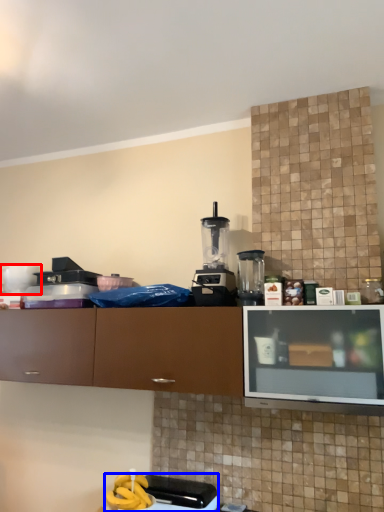
Question: Which object is closer to the camera taking this photo, appliance (highlighted by a red box) or appliance (highlighted by a blue box)?

Choices:
 (A) appliance
 (B) appliance

Answer: (B)